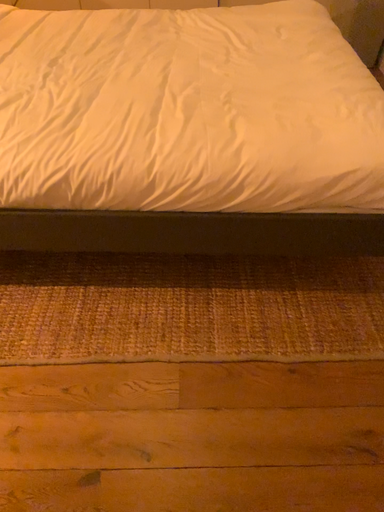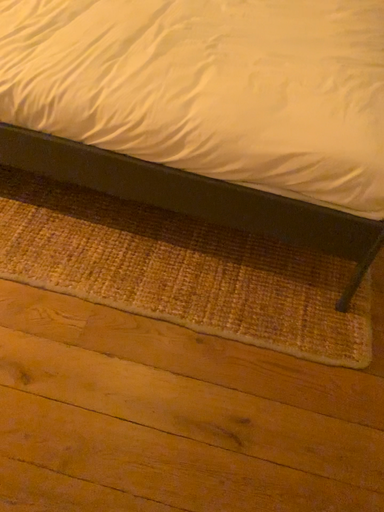
Question: Which way did the camera rotate in the video?

Choices:
 (A) rotated right
 (B) rotated left

Answer: (B)